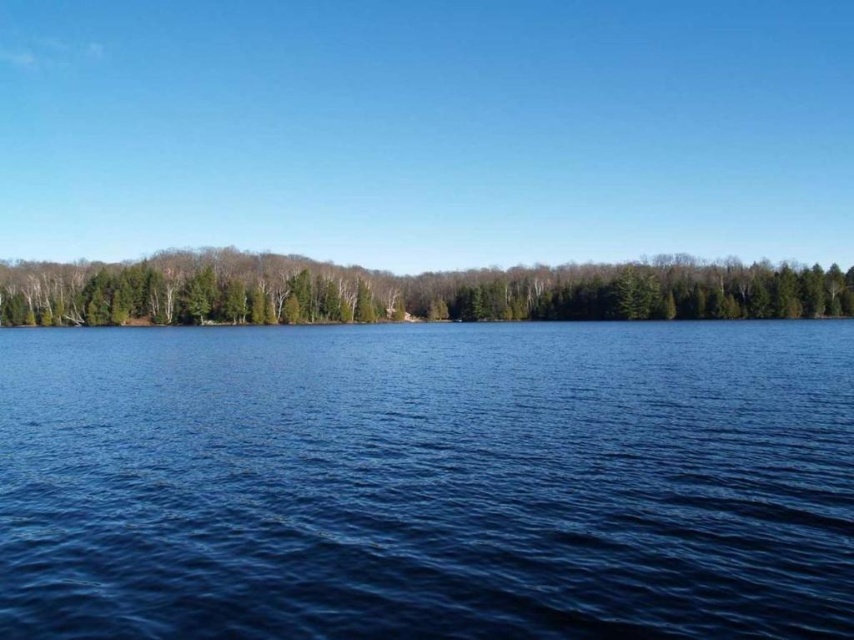
Which is more to the right, deep blue water at center or green matte trees at center?

deep blue water at center

Between deep blue water at center and green matte trees at center, which one has less height?

deep blue water at center is shorter.

Find the location of a particular element. The height and width of the screenshot is (640, 854). deep blue water at center is located at coordinates (428, 481).